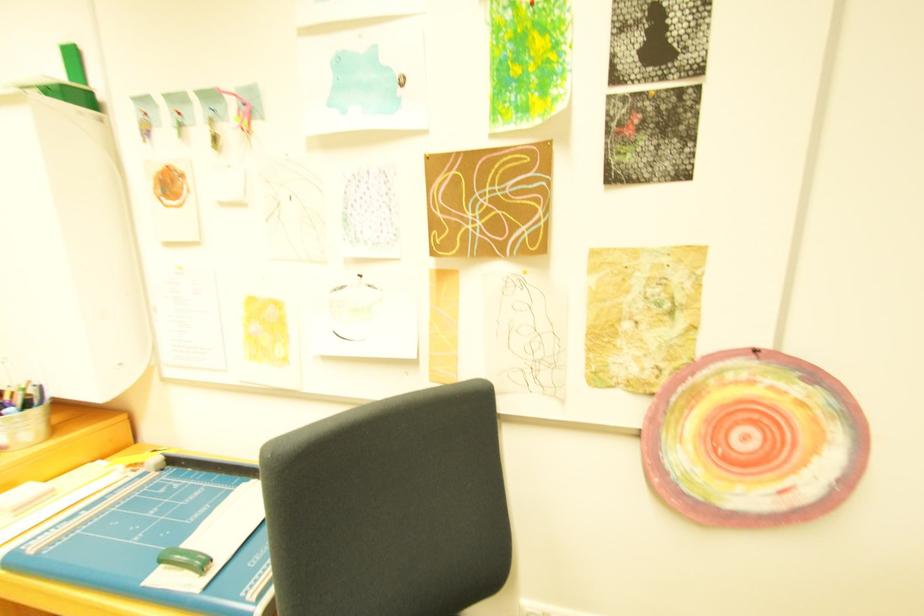
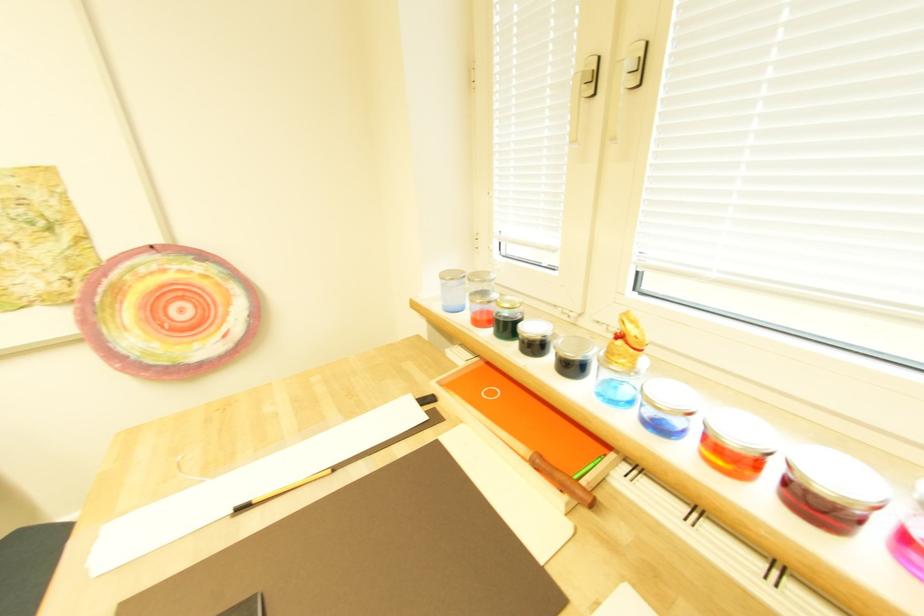
Question: The images are taken continuously from a first-person perspective. In which direction is your viewpoint rotating?

Choices:
 (A) Left
 (B) Right
 (C) Up
 (D) Down

Answer: (B)